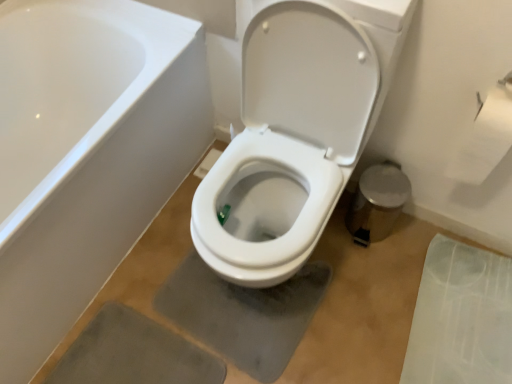
Question: Visually, is white glossy toilet at center positioned to the left or to the right of white paper at upper right?

Choices:
 (A) left
 (B) right

Answer: (A)

Question: Based on their sizes in the image, would you say white glossy toilet at center is bigger or smaller than white paper at upper right?

Choices:
 (A) small
 (B) big

Answer: (B)

Question: Which object is the closest to the white paper at upper right?

Choices:
 (A) white glossy toilet at center
 (B) transparent plastic mat at lower right

Answer: (A)

Question: Based on their relative distances, which object is farther from the white glossy toilet at center?

Choices:
 (A) transparent plastic mat at lower right
 (B) white paper at upper right

Answer: (A)